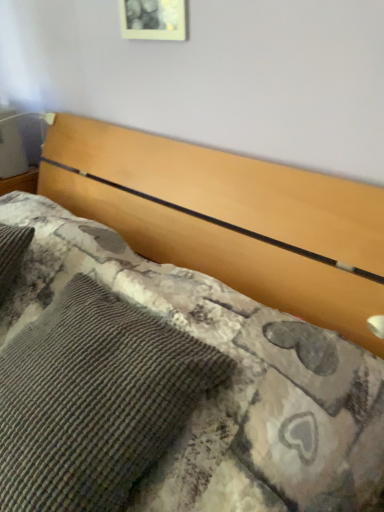
Question: From the image's perspective, relative to matte white picture frame at upper center, is woolen textured pillow at upper center above or below?

Choices:
 (A) below
 (B) above

Answer: (A)

Question: Is woolen textured pillow at upper center bigger or smaller than matte white picture frame at upper center?

Choices:
 (A) big
 (B) small

Answer: (A)

Question: From a real-world perspective, is woolen textured pillow at upper center positioned above or below matte white picture frame at upper center?

Choices:
 (A) below
 (B) above

Answer: (A)

Question: Is matte white picture frame at upper center taller or shorter than woolen textured pillow at upper center?

Choices:
 (A) short
 (B) tall

Answer: (A)

Question: Is point (175, 12) positioned closer to the camera than point (51, 304)?

Choices:
 (A) closer
 (B) farther

Answer: (B)

Question: In the image, is matte white picture frame at upper center on the left side or the right side of woolen textured pillow at upper center?

Choices:
 (A) left
 (B) right

Answer: (B)

Question: In terms of size, does matte white picture frame at upper center appear bigger or smaller than woolen textured pillow at upper center?

Choices:
 (A) small
 (B) big

Answer: (A)